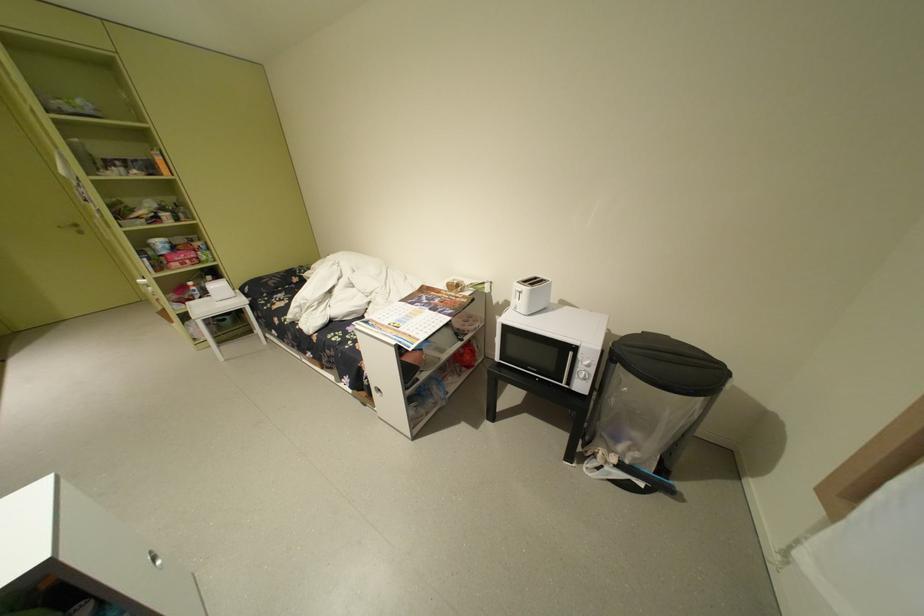
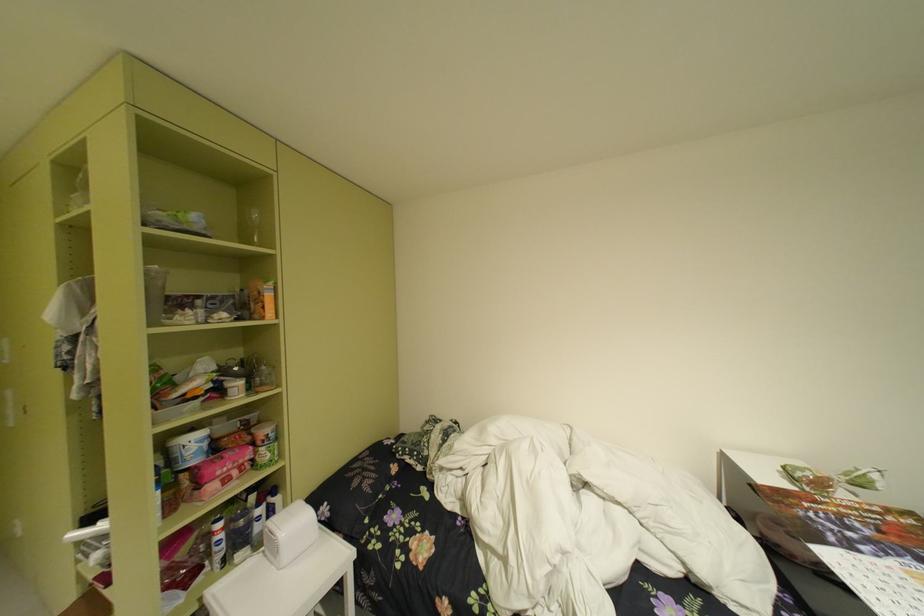
In the second image, find the point that corresponds to (x=204, y=286) in the first image.

(235, 528)